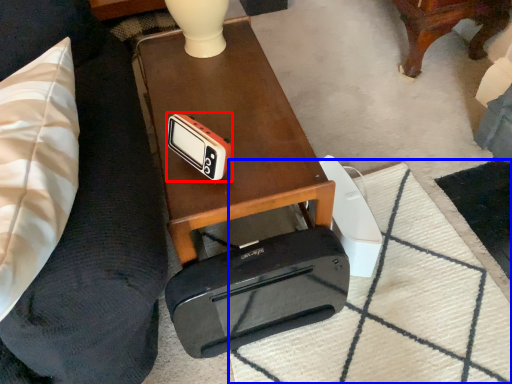
Question: Which of the following is the farthest to the observer, gadget (highlighted by a red box) or mat (highlighted by a blue box)?

Choices:
 (A) gadget
 (B) mat

Answer: (B)